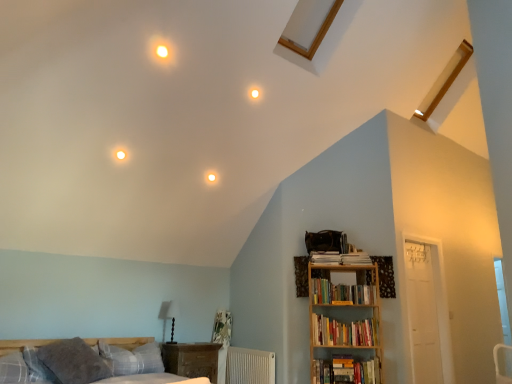
Question: From the image's perspective, is gray soft pillow at lower left, the second pillow viewed from the left, positioned above or below hardcover books at right, the third book viewed from the top?

Choices:
 (A) above
 (B) below

Answer: (A)

Question: Considering the relative positions of gray soft pillow at lower left, the second pillow viewed from the left, and hardcover books at right, the third book viewed from the top, in the image provided, is gray soft pillow at lower left, the second pillow viewed from the left, to the left or to the right of hardcover books at right, the third book viewed from the top,?

Choices:
 (A) left
 (B) right

Answer: (A)

Question: Estimate the real-world distances between objects in this image. Which object is closer to the white textured radiator at lower center?

Choices:
 (A) plaid fabric pillow at lower left, the second pillow viewed from the right
 (B) hardcover books at right, marked as the second book in a top-to-bottom arrangement
 (C) hardcover books at upper right, which is the third book from bottom to top
 (D) plaid fabric bed at lower left
 (E) hardcover books at right, the 1th book from the bottom

Answer: (E)

Question: Estimate the real-world distances between objects in this image. Which object is farther from the hardcover books at right, marked as the second book in a top-to-bottom arrangement?

Choices:
 (A) plaid fabric pillow at lower left, which is the first pillow in left-to-right order
 (B) white textured radiator at lower center
 (C) plaid fabric bed at lower left
 (D) hardcover books at right, the third book viewed from the top
 (E) gray soft pillow at lower left, the first pillow when ordered from right to left

Answer: (A)